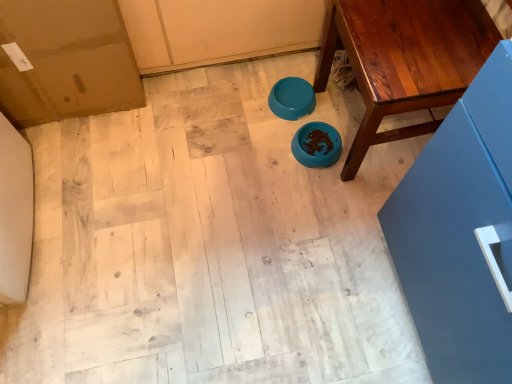
Locate an element on the screen. The image size is (512, 384). free space underneath teal glossy bowl at center, the first bowl when ordered from top to bottom (from a real-world perspective) is located at coordinates (289, 100).